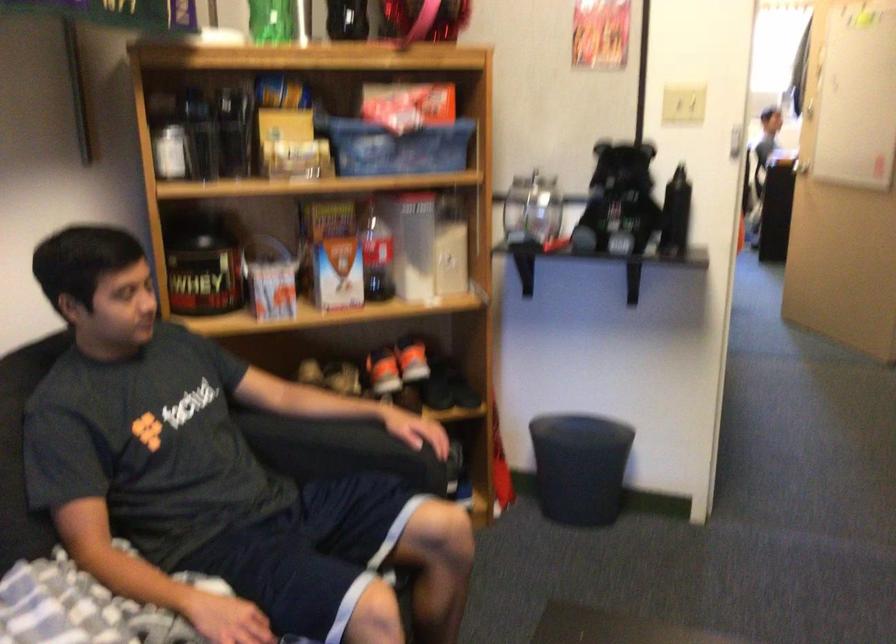
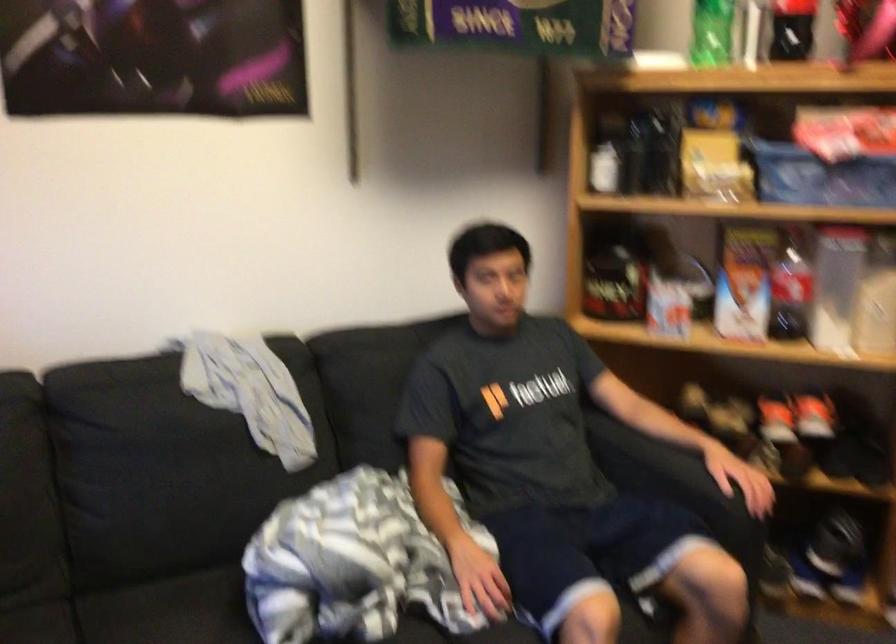
Find the pixel in the second image that matches (175,134) in the first image.

(607, 154)